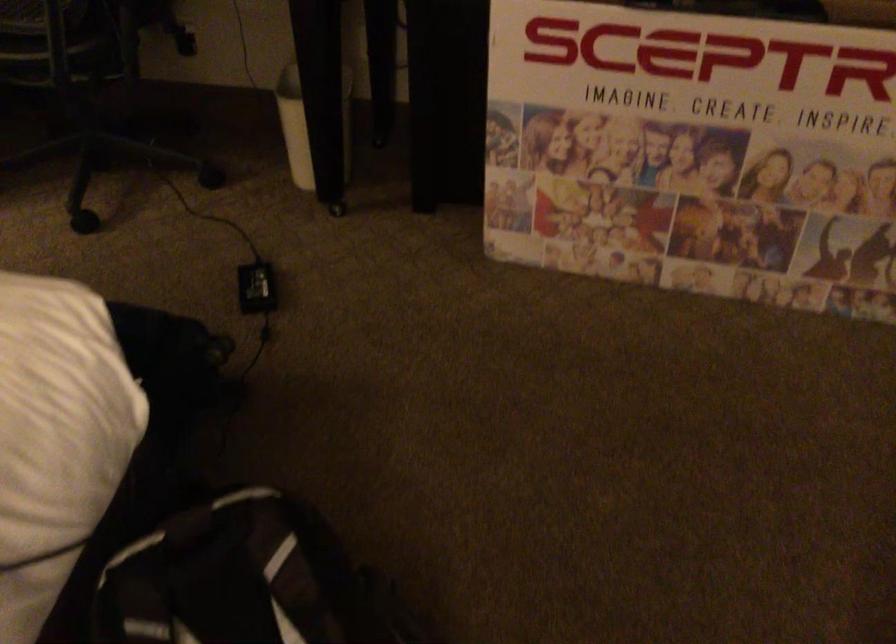
What do you see at coordinates (255, 287) in the screenshot?
I see `the black power adapter` at bounding box center [255, 287].